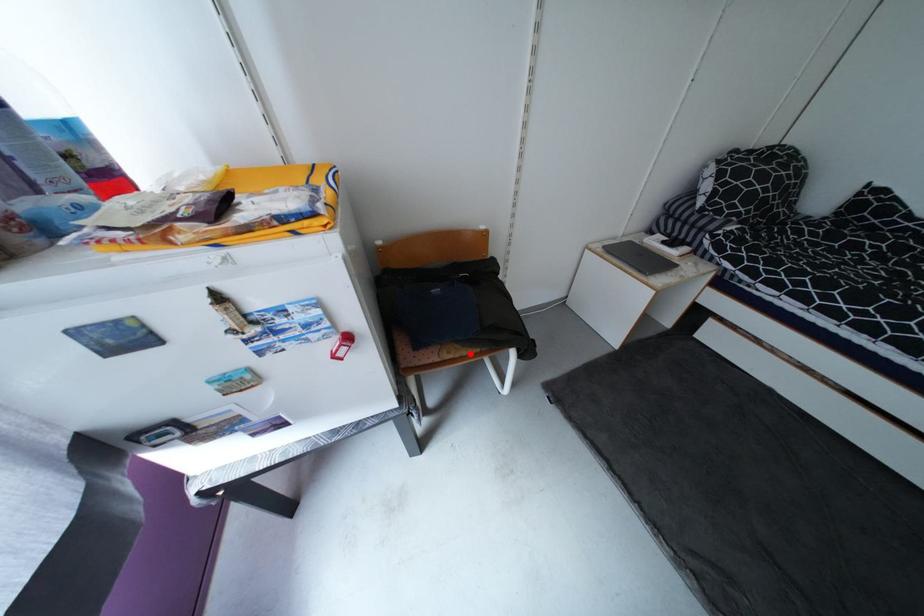
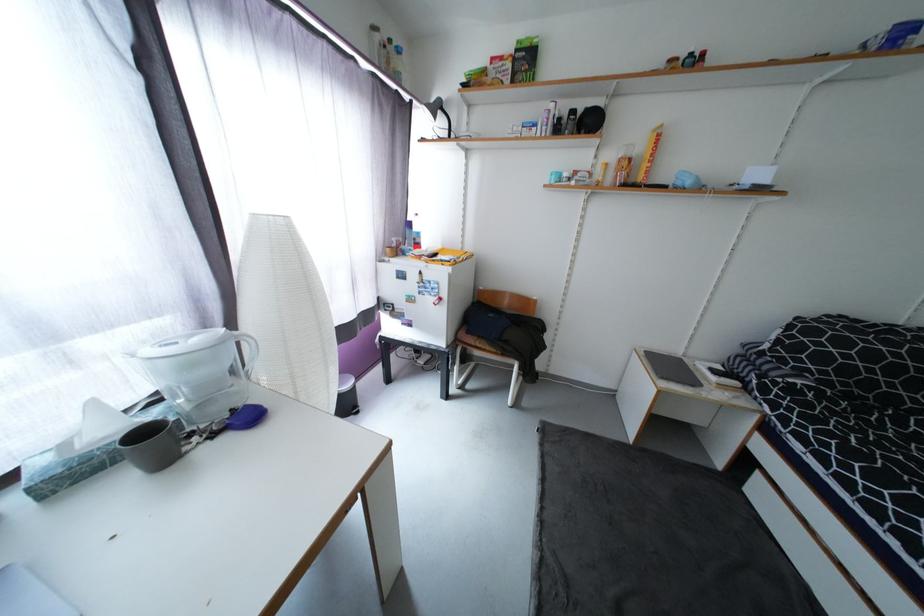
Find the pixel in the second image that matches the highlighted location in the first image.

(493, 349)